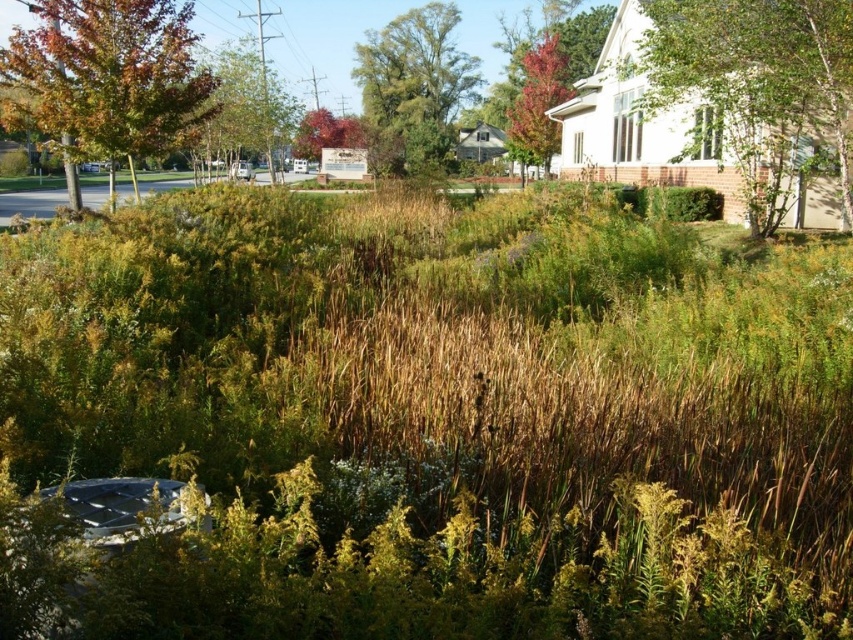
Question: Is green leafy tree at upper center wider than green leafy tree at upper left?

Choices:
 (A) yes
 (B) no

Answer: (B)

Question: Among these points, which one is farthest from the camera?

Choices:
 (A) (231, 81)
 (B) (846, 186)
 (C) (555, 65)
 (D) (447, 54)

Answer: (D)

Question: Which point appears farthest from the camera in this image?

Choices:
 (A) (561, 90)
 (B) (262, 67)

Answer: (A)

Question: Does green grass at center have a larger size compared to autumn leaves at upper left?

Choices:
 (A) yes
 (B) no

Answer: (B)

Question: Which point appears farthest from the camera in this image?

Choices:
 (A) (33, 51)
 (B) (15, 314)
 (C) (746, 8)

Answer: (A)

Question: Is autumn leaves at upper left below reddish-brown bark tree at upper right?

Choices:
 (A) no
 (B) yes

Answer: (B)